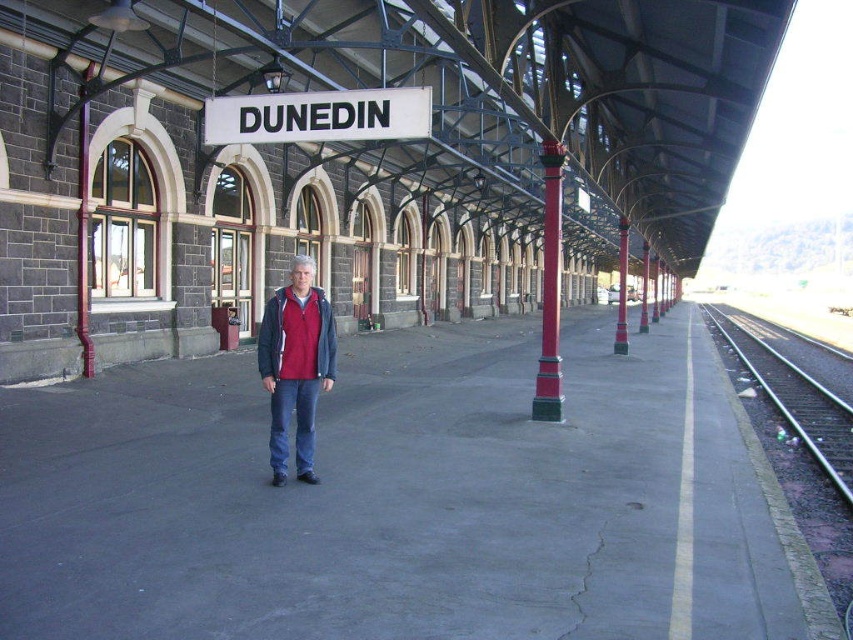
You are a photographer at the Dunedin train station. You want to capture a photo where both the white plastic sign at upper center and the red fleece jacket at center are visible. Which object should you focus on first to ensure both are in frame?

The white plastic sign at upper center is smaller than the red fleece jacket at center, so you should focus on the red fleece jacket at center first to ensure both are in frame.

In the scene shown: You are a photographer standing on the platform at Dunedin station. You notice the white plastic sign at upper center and the red fleece jacket at center. Which object appears taller in the photo?

The red fleece jacket at center is taller than the white plastic sign at upper center.